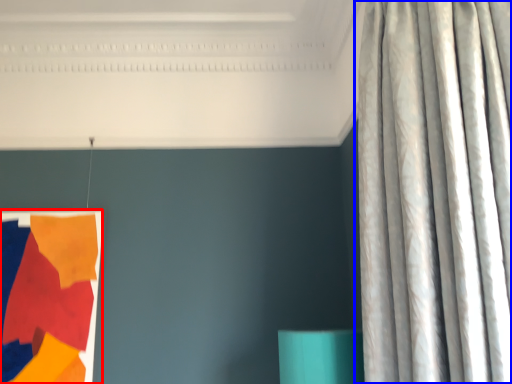
Question: Which of the following is the farthest to the observer, tapestry (highlighted by a red box) or curtain (highlighted by a blue box)?

Choices:
 (A) tapestry
 (B) curtain

Answer: (A)